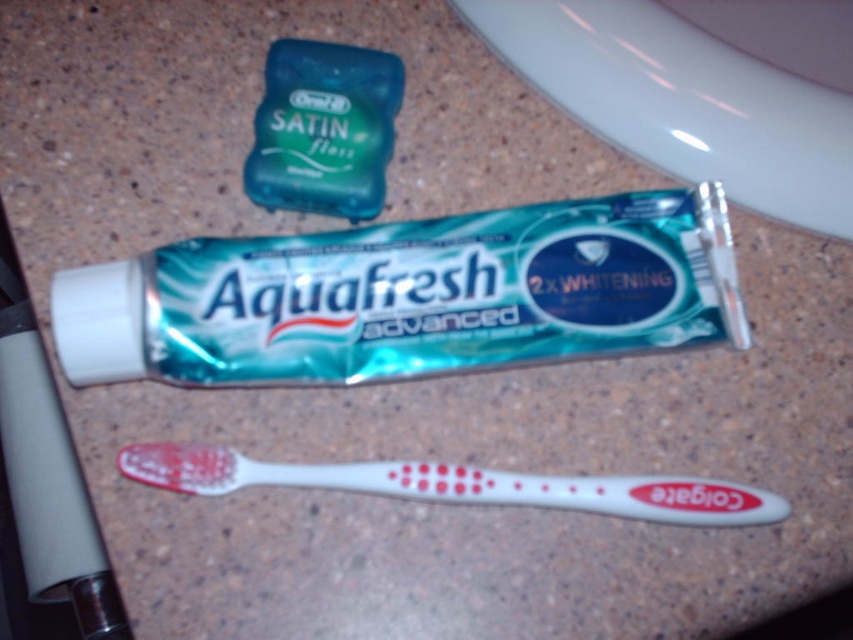
Question: Can you confirm if green glossy toothpaste at center is positioned to the left of white plastic toothbrush at lower center?

Choices:
 (A) yes
 (B) no

Answer: (A)

Question: Does green glossy toothpaste at center lie behind white plastic toothbrush at lower center?

Choices:
 (A) yes
 (B) no

Answer: (B)

Question: From the image, what is the correct spatial relationship of green glossy toothpaste at center in relation to white plastic toothbrush at lower center?

Choices:
 (A) right
 (B) left

Answer: (B)

Question: Which point is closer to the camera taking this photo?

Choices:
 (A) (151, 316)
 (B) (676, 497)

Answer: (A)